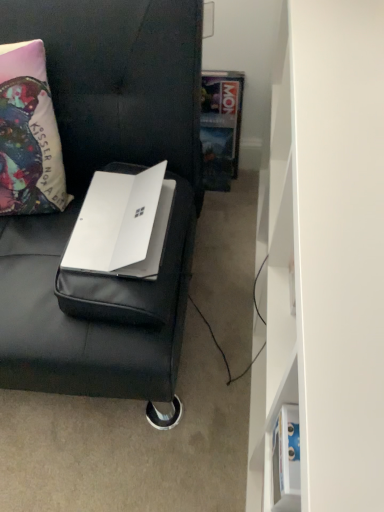
Question: Does white matte bookshelf at right have a larger size compared to hardcover book at center?

Choices:
 (A) no
 (B) yes

Answer: (B)

Question: Does white matte bookshelf at right turn towards hardcover book at center?

Choices:
 (A) yes
 (B) no

Answer: (A)

Question: Is white matte bookshelf at right positioned with its back to hardcover book at center?

Choices:
 (A) no
 (B) yes

Answer: (A)

Question: Would you consider white matte bookshelf at right to be distant from hardcover book at center?

Choices:
 (A) yes
 (B) no

Answer: (B)

Question: Is the position of white matte bookshelf at right more distant than that of hardcover book at center?

Choices:
 (A) yes
 (B) no

Answer: (B)

Question: From the image's perspective, is matte fabric pillow at left above or below white matte bookshelf at right?

Choices:
 (A) above
 (B) below

Answer: (A)

Question: Is matte fabric pillow at left taller or shorter than white matte bookshelf at right?

Choices:
 (A) short
 (B) tall

Answer: (A)

Question: Looking at their shapes, would you say matte fabric pillow at left is wider or thinner than white matte bookshelf at right?

Choices:
 (A) thin
 (B) wide

Answer: (A)

Question: From a real-world perspective, is matte fabric pillow at left positioned above or below white matte bookshelf at right?

Choices:
 (A) below
 (B) above

Answer: (B)

Question: In terms of width, does white matte laptop at center look wider or thinner when compared to hardcover book at center?

Choices:
 (A) wide
 (B) thin

Answer: (A)

Question: Is point 153,237 closer or farther from the camera than point 236,124?

Choices:
 (A) farther
 (B) closer

Answer: (B)

Question: Considering their positions, is white matte laptop at center located in front of or behind hardcover book at center?

Choices:
 (A) behind
 (B) front

Answer: (B)

Question: From a real-world perspective, is white matte laptop at center above or below hardcover book at center?

Choices:
 (A) below
 (B) above

Answer: (B)

Question: Looking at their shapes, would you say white matte laptop at left is wider or thinner than hardcover book at center?

Choices:
 (A) thin
 (B) wide

Answer: (B)

Question: Based on their positions, is white matte laptop at left located to the left or right of hardcover book at center?

Choices:
 (A) right
 (B) left

Answer: (B)